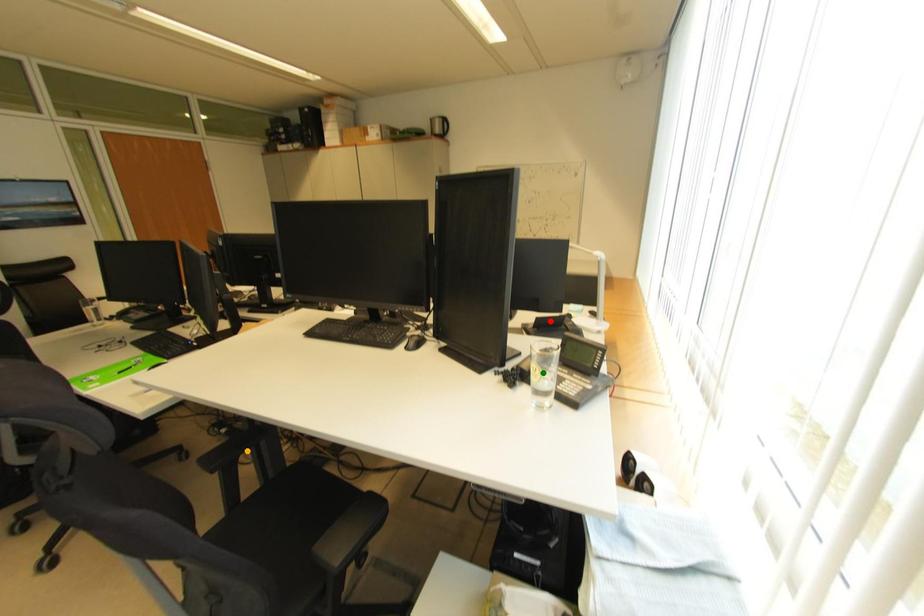
Looking at this image, order these from nearest to farthest:
A) green point
B) red point
C) orange point

orange point
red point
green point